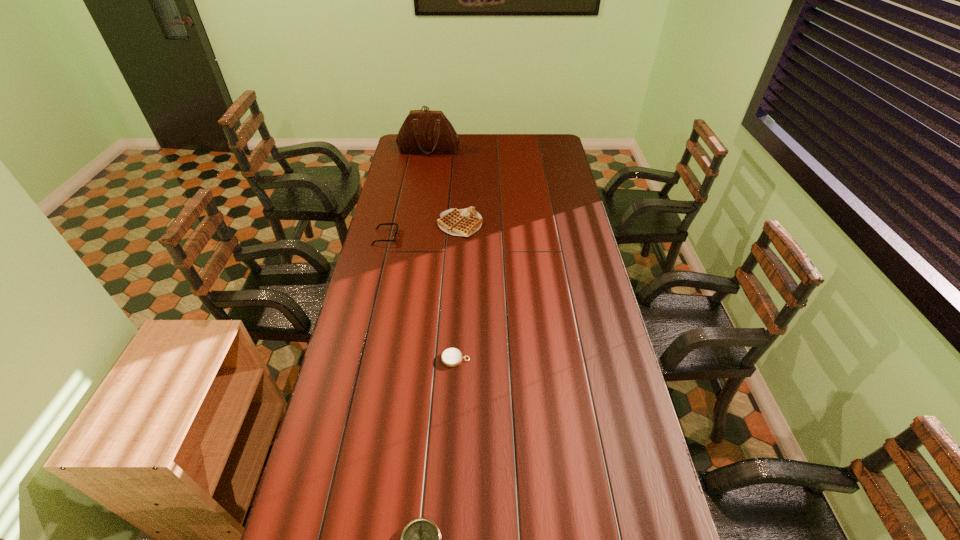
Image resolution: width=960 pixels, height=540 pixels. Identify the location of free space between the third tallest object and the farthest object. (407, 193).

This screenshot has height=540, width=960. I want to click on free space between the farthest object and the sunglasses, so click(407, 193).

Locate an element on the screen. This screenshot has height=540, width=960. vacant point located between the second tallest object and the shoulder bag is located at coordinates (444, 187).

The height and width of the screenshot is (540, 960). I want to click on vacant space in between the farthest object and the fourth farthest object, so click(443, 254).

Where is `the closest object to the shorter compass`? The image size is (960, 540). the closest object to the shorter compass is located at coordinates (421, 539).

Locate which object is the second closest to the third shortest object. Please provide its 2D coordinates. Your answer should be formatted as a tuple, i.e. [(x, y)], where the tuple contains the x and y coordinates of a point satisfying the conditions above.

[(451, 357)]

Where is `vacant position in the image that satisfies the following two spatial constraints: 1. on the front-facing side of the third shortest object; 2. on the left side of the fourth farthest object`? The width and height of the screenshot is (960, 540). vacant position in the image that satisfies the following two spatial constraints: 1. on the front-facing side of the third shortest object; 2. on the left side of the fourth farthest object is located at coordinates click(x=355, y=359).

The height and width of the screenshot is (540, 960). I want to click on free space that satisfies the following two spatial constraints: 1. on the front side of the shoulder bag; 2. on the left side of the waffle, so click(416, 224).